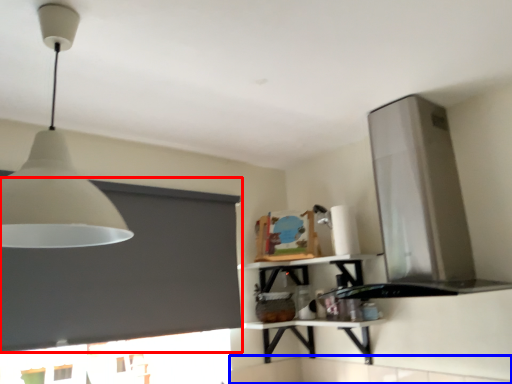
Question: Which object is closer to the camera taking this photo, window screen (highlighted by a red box) or counter top (highlighted by a blue box)?

Choices:
 (A) window screen
 (B) counter top

Answer: (A)